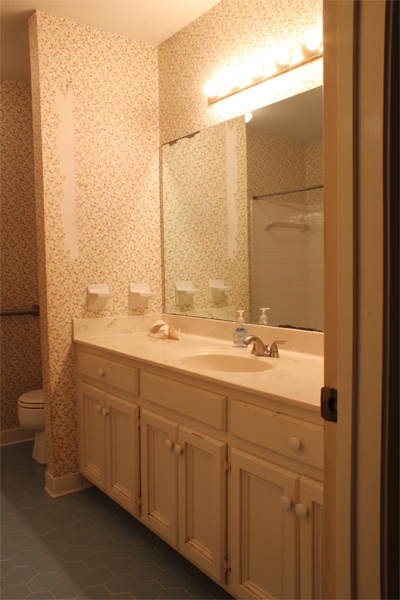
I want to click on tile floor, so click(43, 553).